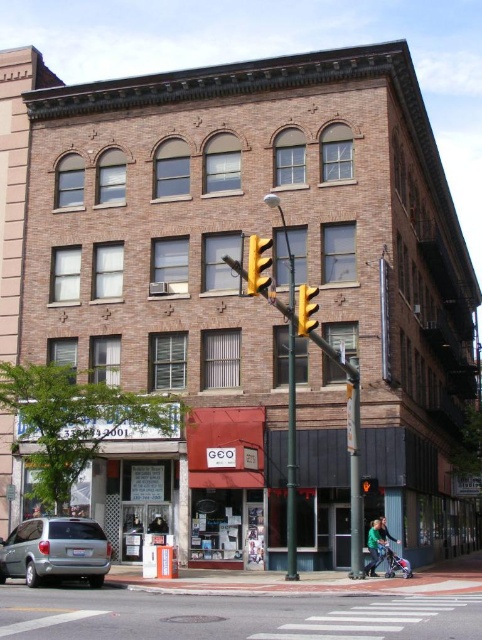
Question: Observing the image, what is the correct spatial positioning of yellow metallic traffic light at center in reference to yellow matte traffic light at center?

Choices:
 (A) right
 (B) left

Answer: (B)

Question: Is silver metallic minivan at lower left bigger than yellow matte traffic light at center?

Choices:
 (A) no
 (B) yes

Answer: (A)

Question: Is silver metallic minivan at lower left smaller than yellow metallic traffic light at center?

Choices:
 (A) no
 (B) yes

Answer: (B)

Question: Considering the real-world distances, which object is farthest from the yellow matte traffic light at center?

Choices:
 (A) yellow metallic traffic light at center
 (B) silver metallic minivan at lower left

Answer: (B)

Question: Considering the real-world distances, which object is closest to the yellow matte traffic light at center?

Choices:
 (A) silver metallic minivan at lower left
 (B) yellow metallic traffic light at center

Answer: (B)

Question: Which object appears farthest from the camera in this image?

Choices:
 (A) silver metallic minivan at lower left
 (B) yellow metallic traffic light at center
 (C) yellow matte traffic light at center

Answer: (A)